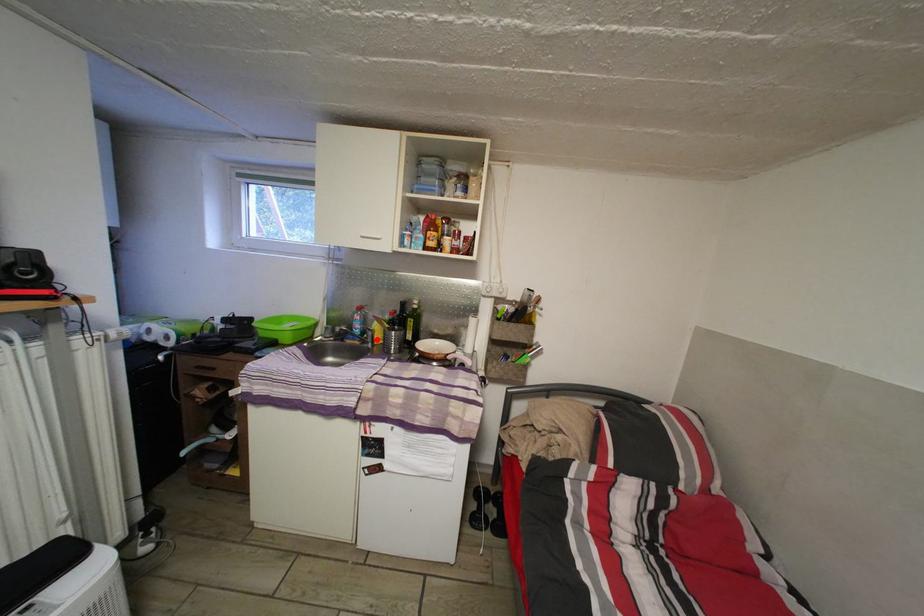
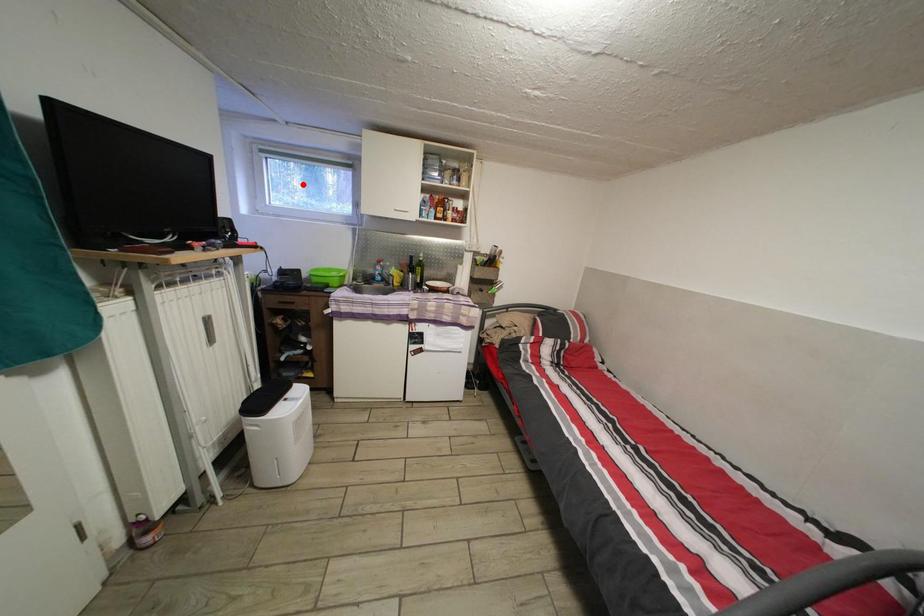
I am providing you with two images of the same scene from different viewpoints. A red point is marked on the first image and another point is marked on the second image. Do the highlighted points in image1 and image2 indicate the same real-world spot?

No